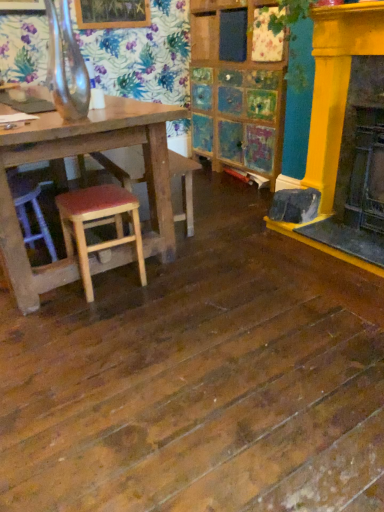
Question: Does point click(334, 86) appear closer or farther from the camera than point click(177, 215)?

Choices:
 (A) closer
 (B) farther

Answer: (A)

Question: Looking at the image, does yellow painted wood fireplace at right seem bigger or smaller compared to wooden seat at center?

Choices:
 (A) small
 (B) big

Answer: (A)

Question: Which is farther from the yellow painted wood fireplace at right?

Choices:
 (A) wooden seat at center
 (B) wooden stool with red cushion at lower left

Answer: (B)

Question: Estimate the real-world distances between objects in this image. Which object is farther from the wooden stool with red cushion at lower left?

Choices:
 (A) wooden seat at center
 (B) yellow painted wood fireplace at right

Answer: (B)